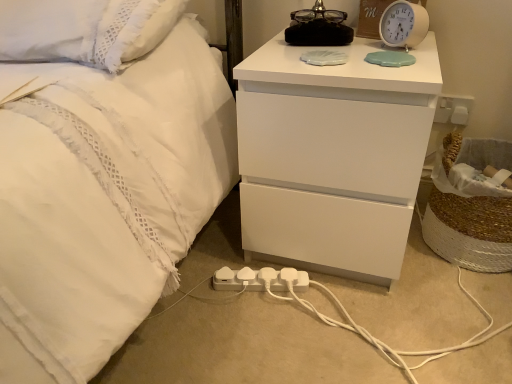
Question: Should I look upward or downward to see white matte nightstand at upper right?

Choices:
 (A) up
 (B) down

Answer: (A)

Question: Does white plastic alarm clock at upper right have a lesser width compared to white plastic extension cord at lower center?

Choices:
 (A) no
 (B) yes

Answer: (A)

Question: Is the surface of white plastic alarm clock at upper right in direct contact with white plastic extension cord at lower center?

Choices:
 (A) yes
 (B) no

Answer: (B)

Question: Are white plastic alarm clock at upper right and white plastic extension cord at lower center located far from each other?

Choices:
 (A) no
 (B) yes

Answer: (A)

Question: Is white plastic alarm clock at upper right smaller than white plastic extension cord at lower center?

Choices:
 (A) yes
 (B) no

Answer: (B)

Question: Considering the relative sizes of white plastic alarm clock at upper right and white plastic extension cord at lower center in the image provided, is white plastic alarm clock at upper right bigger than white plastic extension cord at lower center?

Choices:
 (A) no
 (B) yes

Answer: (B)

Question: From the image's perspective, does white plastic alarm clock at upper right appear higher than white plastic extension cord at lower center?

Choices:
 (A) no
 (B) yes

Answer: (B)

Question: Is white matte nightstand at upper right positioned with its back to white plastic alarm clock at upper right?

Choices:
 (A) yes
 (B) no

Answer: (B)

Question: From a real-world perspective, is white matte nightstand at upper right on white plastic alarm clock at upper right?

Choices:
 (A) yes
 (B) no

Answer: (B)

Question: From a real-world perspective, is white matte nightstand at upper right positioned under white plastic alarm clock at upper right based on gravity?

Choices:
 (A) yes
 (B) no

Answer: (A)

Question: Is white matte nightstand at upper right next to white plastic alarm clock at upper right and touching it?

Choices:
 (A) yes
 (B) no

Answer: (B)

Question: Does white matte nightstand at upper right have a lesser width compared to white plastic alarm clock at upper right?

Choices:
 (A) yes
 (B) no

Answer: (B)

Question: Considering the relative sizes of white matte nightstand at upper right and white plastic alarm clock at upper right in the image provided, is white matte nightstand at upper right taller than white plastic alarm clock at upper right?

Choices:
 (A) yes
 (B) no

Answer: (A)

Question: Does white plastic alarm clock at upper right have a lesser width compared to white matte nightstand at upper right?

Choices:
 (A) no
 (B) yes

Answer: (B)